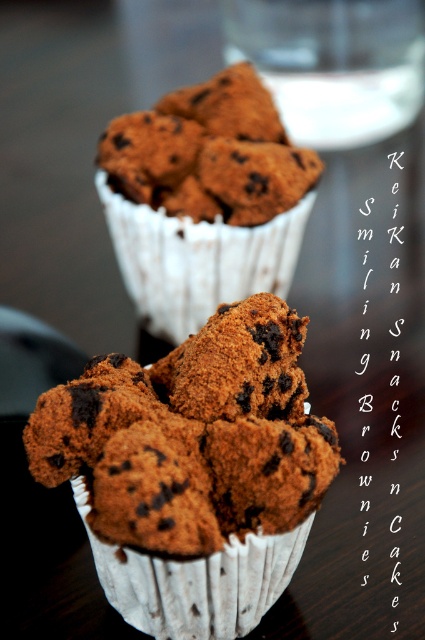
Which is more to the left, chocolate-coated muffin at center or brown matte chocolate chip muffin at center?

From the viewer's perspective, chocolate-coated muffin at center appears more on the left side.

What do you see at coordinates (193, 470) in the screenshot? The height and width of the screenshot is (640, 425). I see `chocolate-coated muffin at center` at bounding box center [193, 470].

Find the location of `chocolate-coated muffin at center`. chocolate-coated muffin at center is located at coordinates (193, 470).